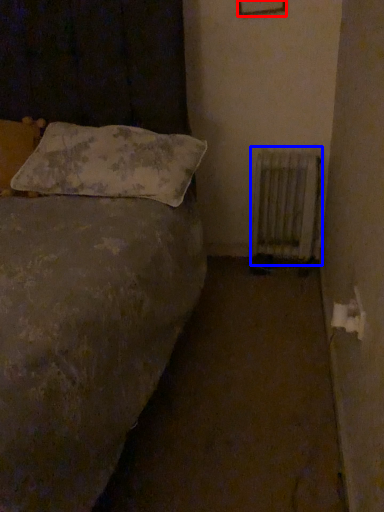
Question: Which point is further to the camera, picture frame (highlighted by a red box) or radiator (highlighted by a blue box)?

Choices:
 (A) picture frame
 (B) radiator

Answer: (B)